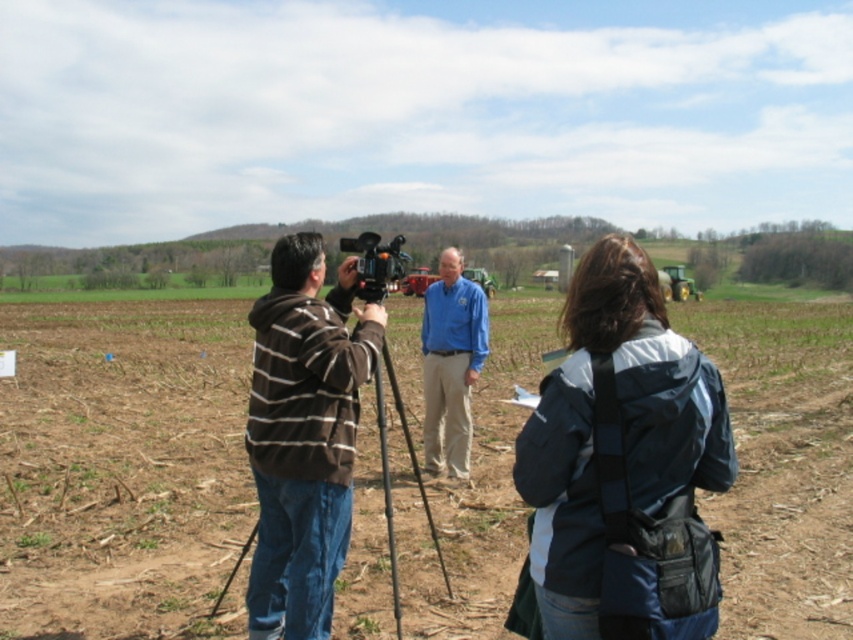
Is blue cotton shirt at center bigger than black plastic camera at center?

Actually, blue cotton shirt at center might be smaller than black plastic camera at center.

Between blue cotton shirt at center and black plastic camera at center, which one appears on the right side from the viewer's perspective?

blue cotton shirt at center is more to the right.

Does point (445, 289) lie behind point (370, 280)?

Yes, point (445, 289) is behind point (370, 280).

Locate an element on the screen. This screenshot has height=640, width=853. blue cotton shirt at center is located at coordinates tap(451, 364).

Does brown soil at center have a larger size compared to brown striped hoodie at center?

Correct, brown soil at center is larger in size than brown striped hoodie at center.

Is brown soil at center to the right of brown striped hoodie at center from the viewer's perspective?

Yes, brown soil at center is to the right of brown striped hoodie at center.

Where is `brown soil at center`? The image size is (853, 640). brown soil at center is located at coordinates (120, 465).

Which is more to the left, brown soil at center or dark blue jacket at center?

dark blue jacket at center

Based on the photo, who is more distant from viewer, (79, 636) or (708, 465)?

Positioned behind is point (79, 636).

The image size is (853, 640). Find the location of `brown soil at center`. brown soil at center is located at coordinates (120, 465).